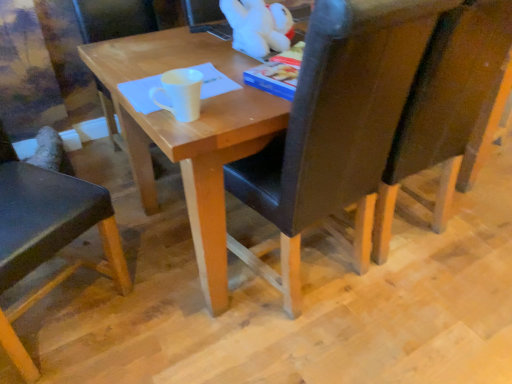
This screenshot has height=384, width=512. I want to click on free space in front of dark brown leather chair at right, the fourth chair positioned from the left, so click(x=436, y=321).